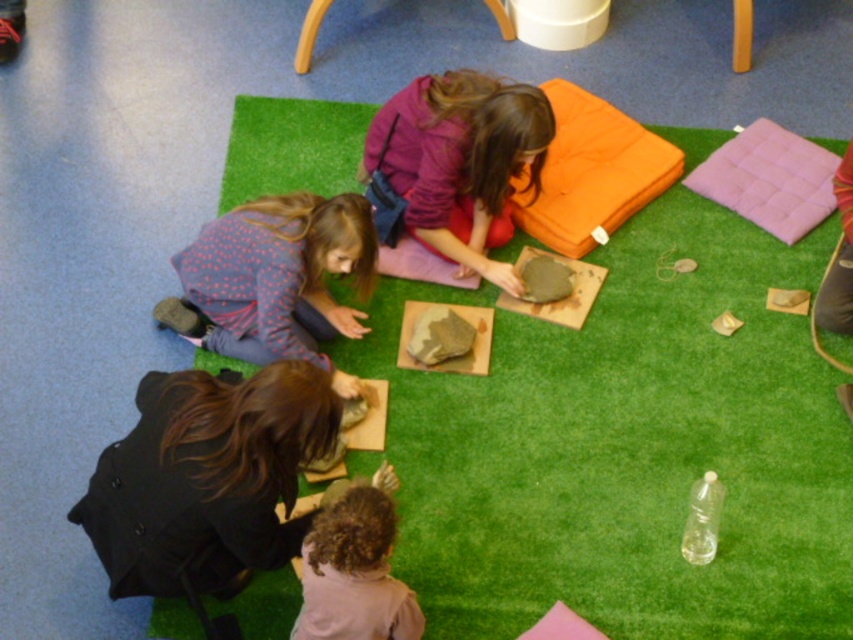
You are a student in the classroom looking at the image. There is a matte purple sweater at center and a pink fabric cushion at upper right. Which object is positioned lower in the image?

The matte purple sweater at center is below the pink fabric cushion at upper right, so the matte purple sweater at center is positioned lower in the image.